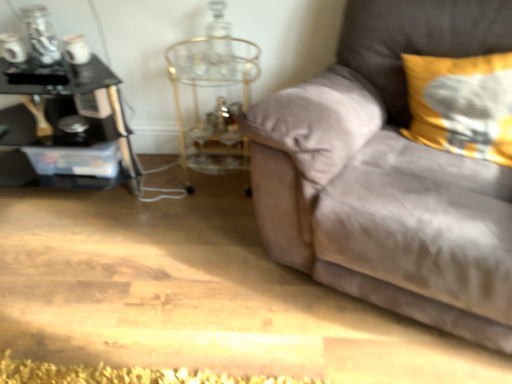
Question: Is yellow fabric pillow at upper right positioned with its back to black glass table at left?

Choices:
 (A) no
 (B) yes

Answer: (A)

Question: Can black glass table at left be found inside yellow fabric pillow at upper right?

Choices:
 (A) no
 (B) yes

Answer: (A)

Question: Is yellow fabric pillow at upper right completely or partially outside of black glass table at left?

Choices:
 (A) no
 (B) yes

Answer: (B)

Question: Are yellow fabric pillow at upper right and black glass table at left beside each other?

Choices:
 (A) yes
 (B) no

Answer: (B)

Question: Is yellow fabric pillow at upper right positioned far away from black glass table at left?

Choices:
 (A) no
 (B) yes

Answer: (B)

Question: Is suede couch at right to the left or to the right of yellow fabric pillow at upper right in the image?

Choices:
 (A) right
 (B) left

Answer: (B)

Question: Would you say suede couch at right is inside or outside yellow fabric pillow at upper right?

Choices:
 (A) outside
 (B) inside

Answer: (A)

Question: Looking at their shapes, would you say suede couch at right is wider or thinner than yellow fabric pillow at upper right?

Choices:
 (A) thin
 (B) wide

Answer: (B)

Question: In terms of height, does suede couch at right look taller or shorter compared to yellow fabric pillow at upper right?

Choices:
 (A) short
 (B) tall

Answer: (B)

Question: Looking at their shapes, would you say suede couch at right is wider or thinner than gold metallic side table at center?

Choices:
 (A) thin
 (B) wide

Answer: (B)

Question: Considering their positions, is suede couch at right located in front of or behind gold metallic side table at center?

Choices:
 (A) behind
 (B) front

Answer: (B)

Question: From the image's perspective, relative to gold metallic side table at center, is suede couch at right above or below?

Choices:
 (A) below
 (B) above

Answer: (A)

Question: Visually, is suede couch at right positioned to the left or to the right of gold metallic side table at center?

Choices:
 (A) right
 (B) left

Answer: (A)

Question: Is yellow fabric pillow at upper right situated inside black glass table at left or outside?

Choices:
 (A) inside
 (B) outside

Answer: (B)

Question: Considering the positions of yellow fabric pillow at upper right and black glass table at left in the image, is yellow fabric pillow at upper right bigger or smaller than black glass table at left?

Choices:
 (A) small
 (B) big

Answer: (A)